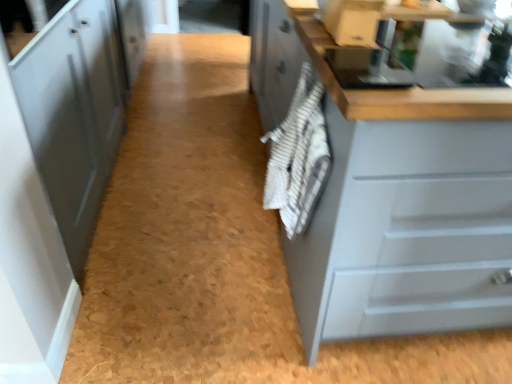
Question: Does matte gray cabinet at left, marked as the 1th cabinetry in a left-to-right arrangement, have a lesser height compared to matte gray cabinet at right, positioned as the first cabinetry in right-to-left order?

Choices:
 (A) yes
 (B) no

Answer: (B)

Question: Is matte gray cabinet at left, marked as the 1th cabinetry in a left-to-right arrangement, oriented towards matte gray cabinet at right, which ranks as the second cabinetry in left-to-right order?

Choices:
 (A) no
 (B) yes

Answer: (B)

Question: Considering the relative sizes of matte gray cabinet at left, which is the 2th cabinetry in right-to-left order, and matte gray cabinet at right, which ranks as the second cabinetry in left-to-right order, in the image provided, is matte gray cabinet at left, which is the 2th cabinetry in right-to-left order, thinner than matte gray cabinet at right, which ranks as the second cabinetry in left-to-right order,?

Choices:
 (A) yes
 (B) no

Answer: (A)

Question: Is matte gray cabinet at left, which is the 2th cabinetry in right-to-left order, to the left of matte gray cabinet at right, positioned as the first cabinetry in right-to-left order, from the viewer's perspective?

Choices:
 (A) yes
 (B) no

Answer: (A)

Question: From a real-world perspective, is matte gray cabinet at left, which is the 2th cabinetry in right-to-left order, positioned under matte gray cabinet at right, positioned as the first cabinetry in right-to-left order, based on gravity?

Choices:
 (A) yes
 (B) no

Answer: (B)

Question: In the image, is matte gray cabinet at left, which is the 2th cabinetry in right-to-left order, positioned in front of or behind matte gray cabinet at right, which ranks as the second cabinetry in left-to-right order?

Choices:
 (A) front
 (B) behind

Answer: (B)

Question: Considering the positions of matte gray cabinet at left, which is the 2th cabinetry in right-to-left order, and matte gray cabinet at right, positioned as the first cabinetry in right-to-left order, in the image, is matte gray cabinet at left, which is the 2th cabinetry in right-to-left order, wider or thinner than matte gray cabinet at right, positioned as the first cabinetry in right-to-left order,?

Choices:
 (A) wide
 (B) thin

Answer: (B)

Question: From a real-world perspective, is matte gray cabinet at left, marked as the 1th cabinetry in a left-to-right arrangement, positioned above or below matte gray cabinet at right, positioned as the first cabinetry in right-to-left order?

Choices:
 (A) below
 (B) above

Answer: (B)

Question: Based on their positions, is matte gray cabinet at left, which is the 2th cabinetry in right-to-left order, located to the left or right of matte gray cabinet at right, which ranks as the second cabinetry in left-to-right order?

Choices:
 (A) right
 (B) left

Answer: (B)

Question: Which is correct: matte gray cabinet at right, positioned as the first cabinetry in right-to-left order, is inside white striped towel at center, or outside of it?

Choices:
 (A) inside
 (B) outside

Answer: (B)

Question: In terms of size, does matte gray cabinet at right, positioned as the first cabinetry in right-to-left order, appear bigger or smaller than white striped towel at center?

Choices:
 (A) small
 (B) big

Answer: (B)

Question: Is matte gray cabinet at right, positioned as the first cabinetry in right-to-left order, taller or shorter than white striped towel at center?

Choices:
 (A) tall
 (B) short

Answer: (A)

Question: Is matte gray cabinet at right, which ranks as the second cabinetry in left-to-right order, wider or thinner than white striped towel at center?

Choices:
 (A) wide
 (B) thin

Answer: (A)

Question: From a real-world perspective, is white striped towel at center physically located above or below matte gray cabinet at right, which ranks as the second cabinetry in left-to-right order?

Choices:
 (A) above
 (B) below

Answer: (A)

Question: Is white striped towel at center in front of or behind matte gray cabinet at right, which ranks as the second cabinetry in left-to-right order, in the image?

Choices:
 (A) behind
 (B) front

Answer: (A)